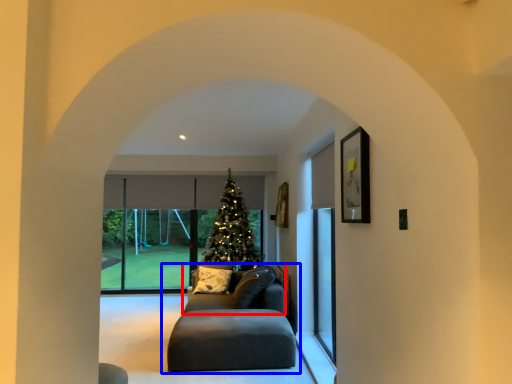
Question: Which of the following is the farthest to the observer, couch (highlighted by a red box) or studio couch (highlighted by a blue box)?

Choices:
 (A) couch
 (B) studio couch

Answer: (A)